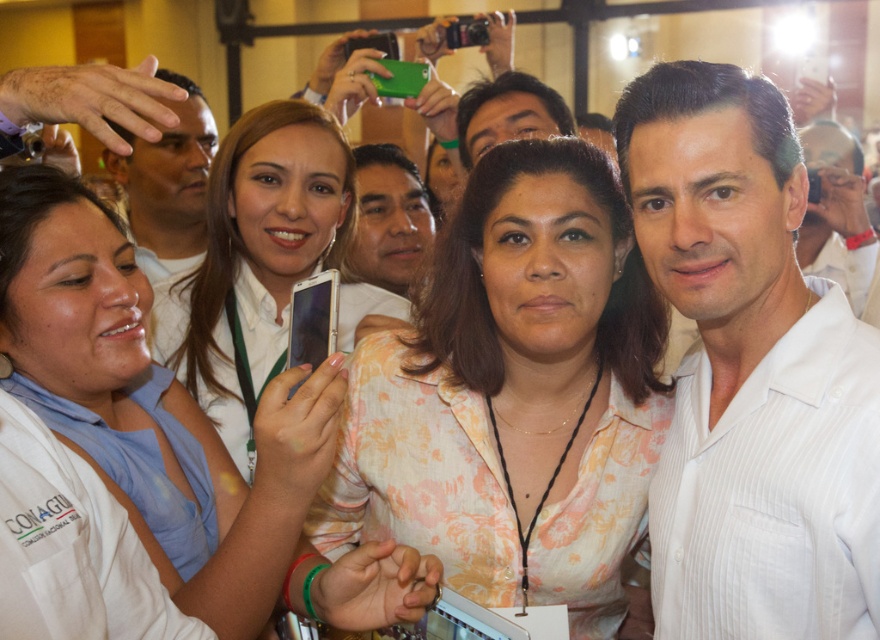
Question: Which of the following is the farthest from the observer?

Choices:
 (A) (254, 486)
 (B) (380, 278)

Answer: (B)

Question: Is white fabric shirt at center to the right of matte white shirt at center from the viewer's perspective?

Choices:
 (A) no
 (B) yes

Answer: (B)

Question: Which point appears closest to the camera in this image?

Choices:
 (A) (88, 314)
 (B) (796, 432)
 (C) (567, 193)

Answer: (B)

Question: Which point is farther from the camera taking this photo?

Choices:
 (A) (602, 227)
 (B) (409, 257)

Answer: (B)

Question: Can you confirm if matte white shirt at center is positioned above matte white face at center?

Choices:
 (A) no
 (B) yes

Answer: (B)

Question: Is floral print blouse at center smaller than white fabric shirt at center?

Choices:
 (A) yes
 (B) no

Answer: (A)